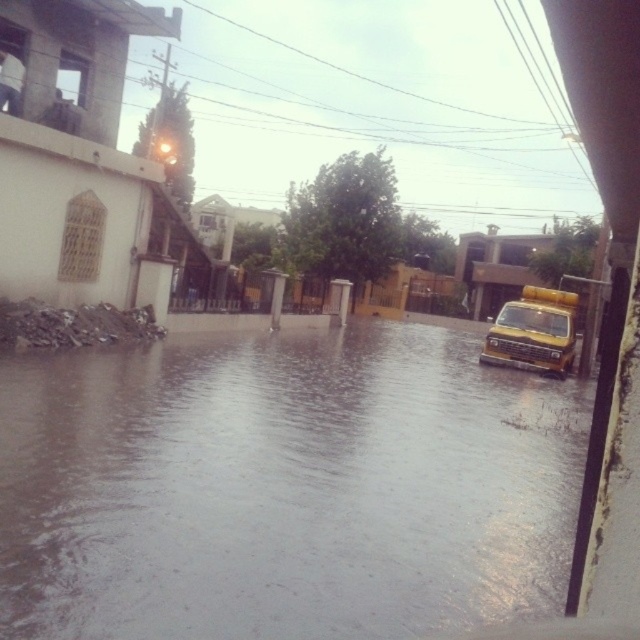
Question: Which object appears farthest from the camera in this image?

Choices:
 (A) yellow matte truck at right
 (B) brown/muddy water at lower center

Answer: (A)

Question: Does brown/muddy water at lower center come behind yellow matte truck at right?

Choices:
 (A) no
 (B) yes

Answer: (A)

Question: Can you confirm if brown/muddy water at lower center is positioned to the left of yellow matte truck at right?

Choices:
 (A) no
 (B) yes

Answer: (B)

Question: Among these points, which one is farthest from the camera?

Choices:
 (A) (362, 467)
 (B) (550, 298)

Answer: (B)

Question: Does brown/muddy water at lower center have a greater width compared to yellow matte truck at right?

Choices:
 (A) yes
 (B) no

Answer: (A)

Question: Which point is farther from the camera taking this photo?

Choices:
 (A) (372, 419)
 (B) (509, 300)

Answer: (B)